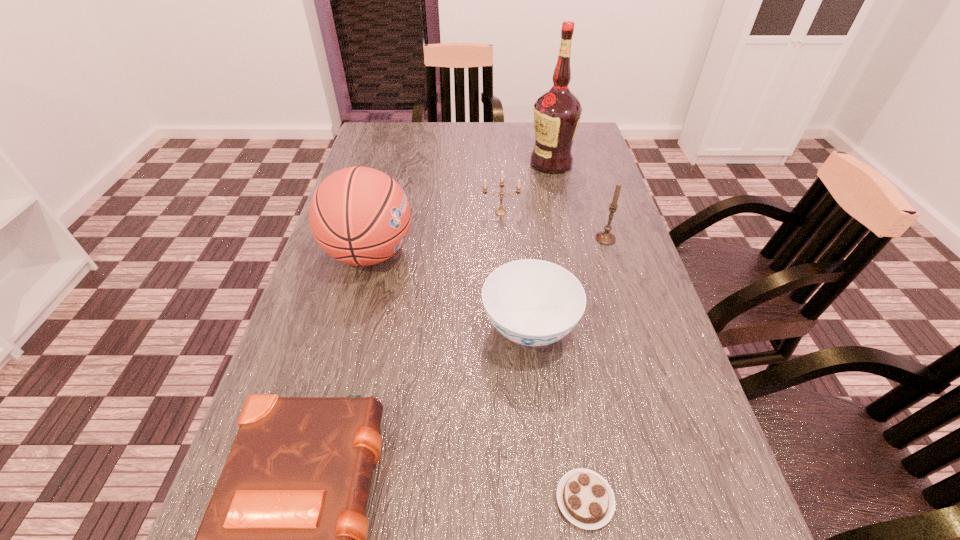
I want to click on vacant space that satisfies the following two spatial constraints: 1. on the back side of the shortest object; 2. on the left side of the nearer candle, so click(x=543, y=239).